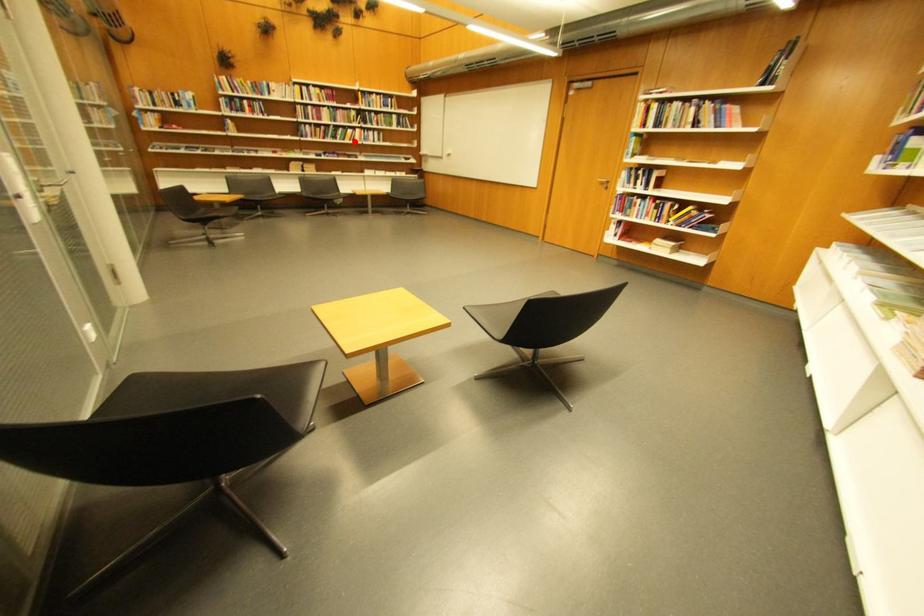
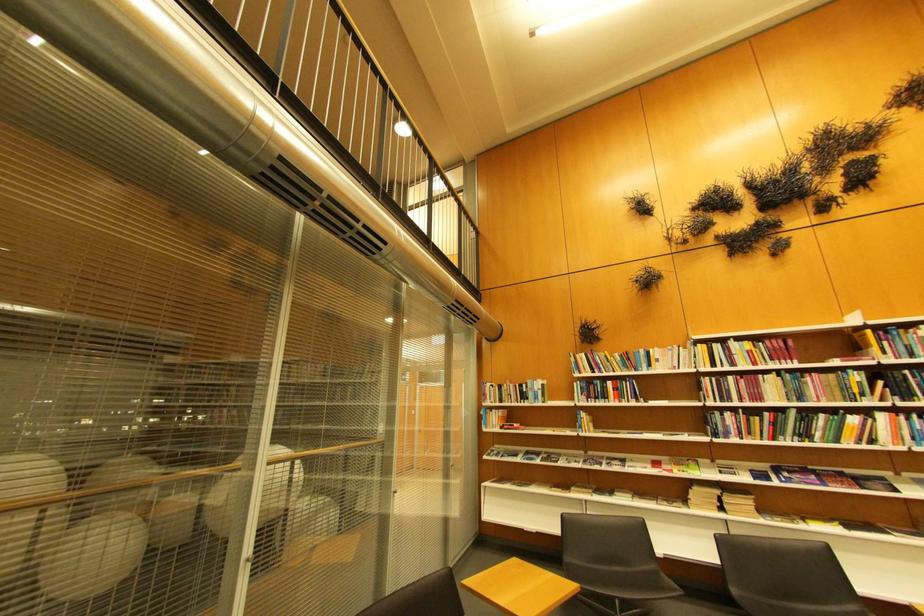
Question: I am providing you with two images of the same scene from different viewpoints. A red point is shown in image1. For the corresponding object point in image2, is it positioned nearer or farther from the camera?

Choices:
 (A) Nearer
 (B) Farther

Answer: (B)